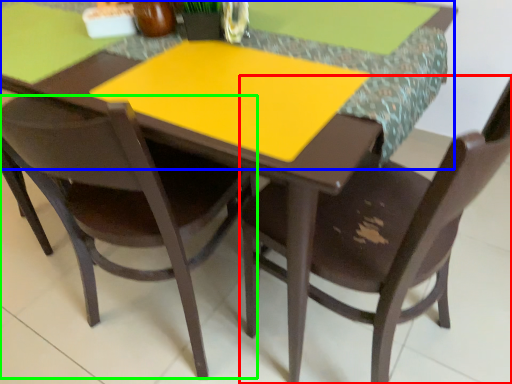
Question: Which is farther away from chair (highlighted by a red box)? counter top (highlighted by a blue box) or chair (highlighted by a green box)?

Choices:
 (A) counter top
 (B) chair

Answer: (B)